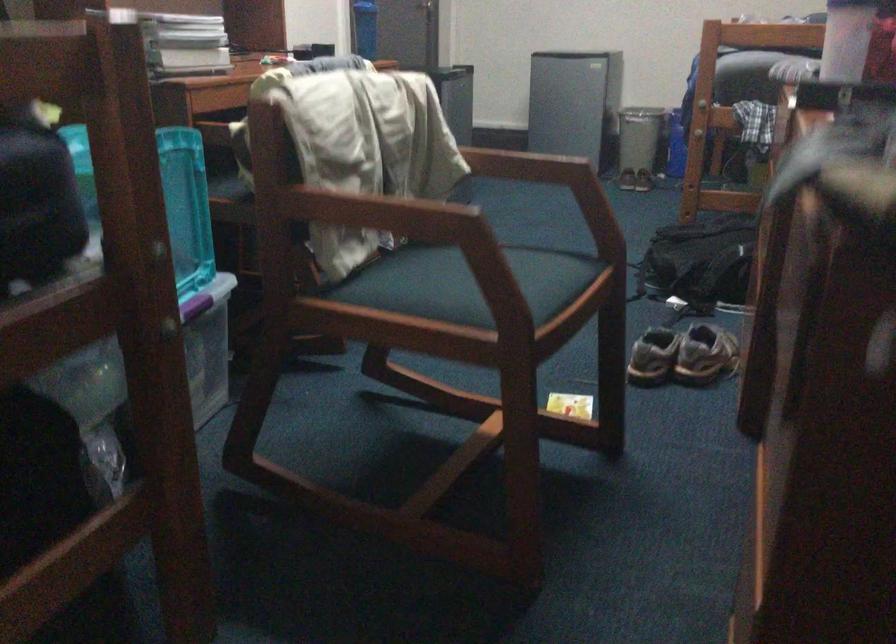
Locate an element on the screen. The height and width of the screenshot is (644, 896). blue water bottle is located at coordinates (365, 28).